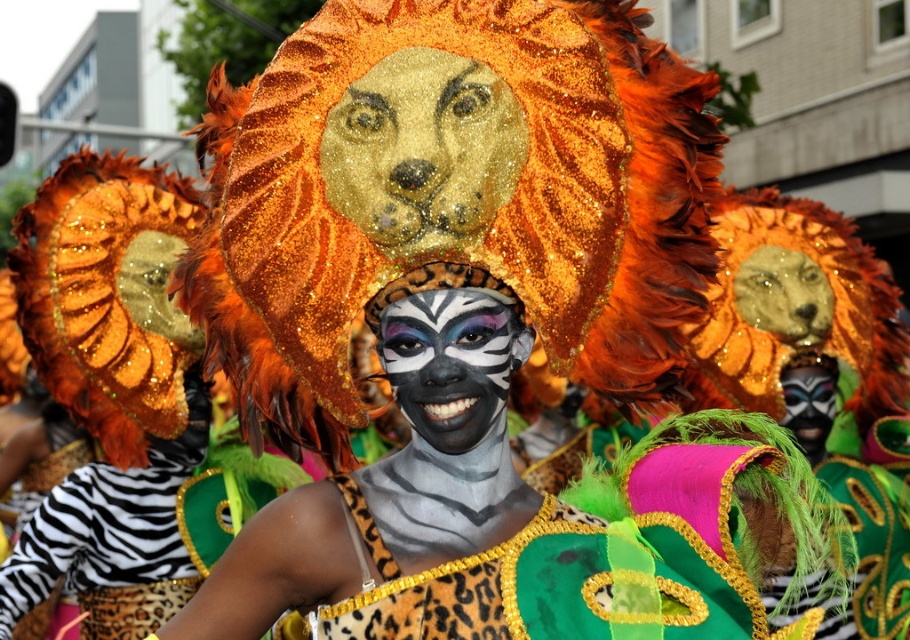
Question: Which point appears farthest from the camera in this image?

Choices:
 (A) (416, 49)
 (B) (827, 388)
 (C) (430, 413)

Answer: (B)

Question: Is gold glittery lion head at center thinner than zebra-striped face paint at center?

Choices:
 (A) yes
 (B) no

Answer: (B)

Question: Can you confirm if gold glittery lion head at center is positioned to the right of zebra-striped face paint at center?

Choices:
 (A) yes
 (B) no

Answer: (B)

Question: Which point is farther to the camera?

Choices:
 (A) (466, 140)
 (B) (413, 349)

Answer: (A)

Question: Can you confirm if zebra-striped face paint at center is thinner than matte black mask at center?

Choices:
 (A) yes
 (B) no

Answer: (B)

Question: Among these objects, which one is farthest from the camera?

Choices:
 (A) gold glittery lion head at center
 (B) zebra-striped face paint at center

Answer: (A)